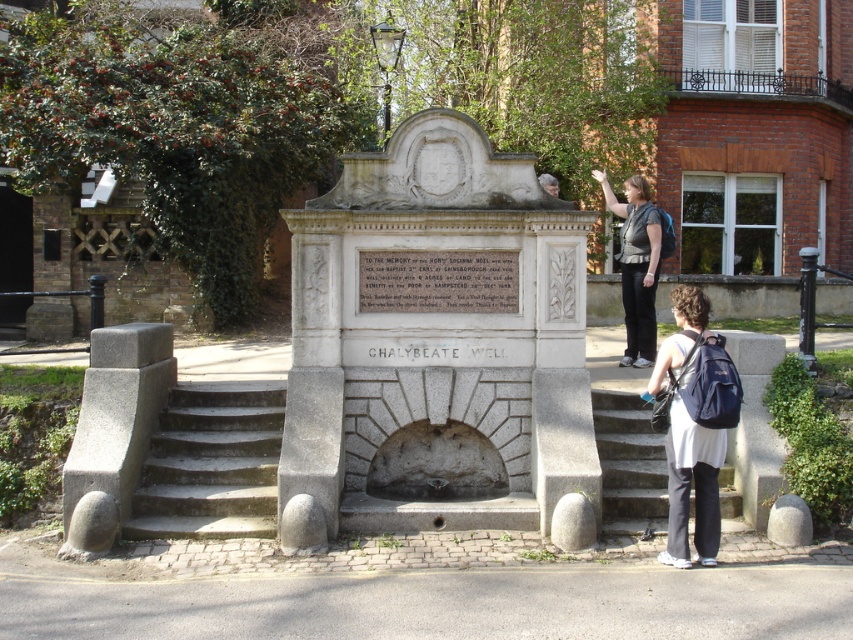
Is white stone fountain at center to the left of gray concrete stairs at lower left from the viewer's perspective?

No, white stone fountain at center is not to the left of gray concrete stairs at lower left.

Identify the location of white stone fountain at center. (434, 344).

Looking at this image, is white stone plaque at center to the left of gray stone stairs at center from the viewer's perspective?

Indeed, white stone plaque at center is positioned on the left side of gray stone stairs at center.

Is white stone plaque at center below gray stone stairs at center?

Actually, white stone plaque at center is above gray stone stairs at center.

Locate an element on the screen. Image resolution: width=853 pixels, height=640 pixels. white stone plaque at center is located at coordinates pos(438,280).

Between point (642, 454) and point (634, 314), which one is positioned behind?

The point (634, 314) is behind.

Does gray stone stairs at center have a larger size compared to dark gray fabric jacket at upper center?

Actually, gray stone stairs at center might be smaller than dark gray fabric jacket at upper center.

Describe the element at coordinates (630, 464) in the screenshot. I see `gray stone stairs at center` at that location.

Where is `gray stone stairs at center`? gray stone stairs at center is located at coordinates (630, 464).